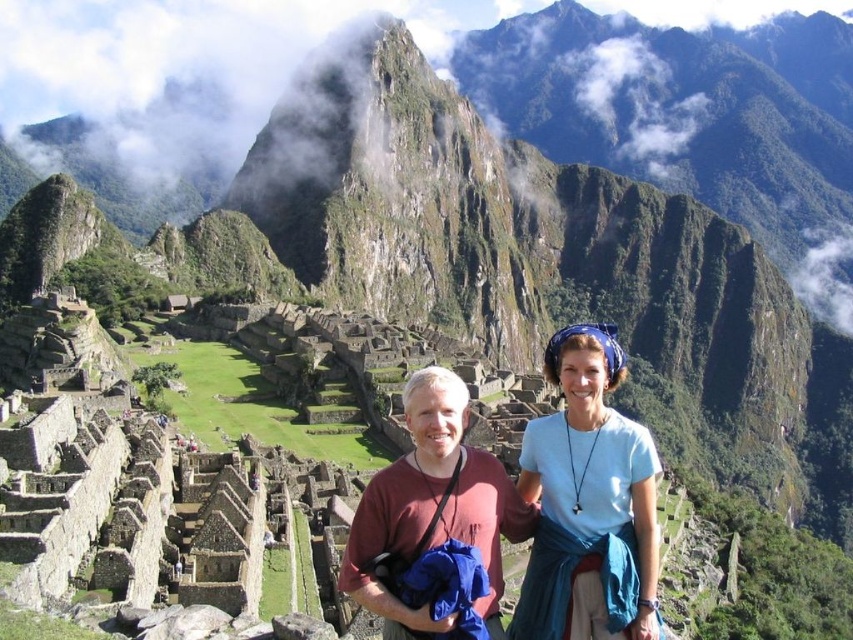
Question: Among these points, which one is nearest to the camera?

Choices:
 (A) (636, 637)
 (B) (415, 448)

Answer: (A)

Question: Is matte red shirt at center wider than blue fabric headscarf at upper right?

Choices:
 (A) no
 (B) yes

Answer: (B)

Question: Considering the relative positions of matte red shirt at center and blue fabric headscarf at upper right in the image provided, where is matte red shirt at center located with respect to blue fabric headscarf at upper right?

Choices:
 (A) right
 (B) left

Answer: (B)

Question: Which point is closer to the camera?

Choices:
 (A) matte red shirt at center
 (B) blue fabric headscarf at upper right

Answer: (A)

Question: Can you confirm if matte red shirt at center is thinner than blue fabric headscarf at upper right?

Choices:
 (A) yes
 (B) no

Answer: (B)